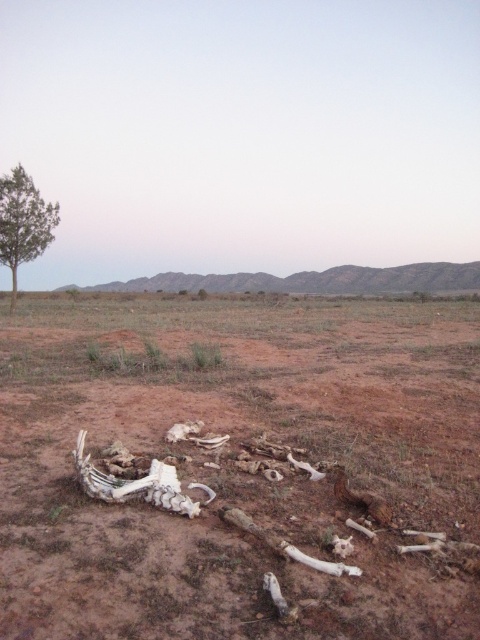
Is brown dirt field at center closer to the viewer compared to green leafy tree at left?

That is True.

Between brown dirt field at center and green leafy tree at left, which one has less height?

Standing shorter between the two is brown dirt field at center.

Who is more distant from viewer, [381,561] or [2,196]?

Positioned behind is point [2,196].

Where is `brown dirt field at center`? The image size is (480, 640). brown dirt field at center is located at coordinates (239, 467).